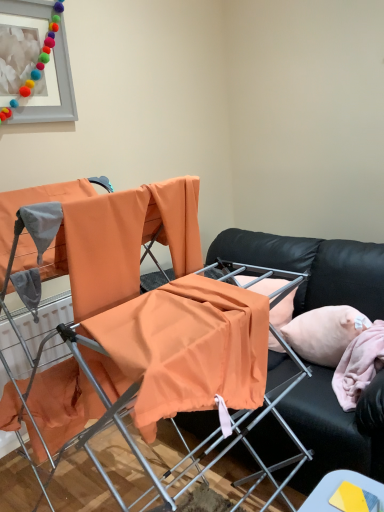
Question: From a real-world perspective, is smooth yellow card at lower right physically below matte gray picture frame at upper left?

Choices:
 (A) yes
 (B) no

Answer: (A)

Question: Considering the relative sizes of smooth yellow card at lower right and matte gray picture frame at upper left in the image provided, is smooth yellow card at lower right smaller than matte gray picture frame at upper left?

Choices:
 (A) yes
 (B) no

Answer: (A)

Question: From the image's perspective, does smooth yellow card at lower right appear lower than matte gray picture frame at upper left?

Choices:
 (A) yes
 (B) no

Answer: (A)

Question: Is smooth yellow card at lower right in front of matte gray picture frame at upper left?

Choices:
 (A) yes
 (B) no

Answer: (A)

Question: Can you confirm if smooth yellow card at lower right is thinner than matte gray picture frame at upper left?

Choices:
 (A) no
 (B) yes

Answer: (A)

Question: Does point (352, 259) appear closer or farther from the camera than point (157, 223)?

Choices:
 (A) closer
 (B) farther

Answer: (B)

Question: In terms of size, does black leather couch at center appear bigger or smaller than orange fabric chair at center?

Choices:
 (A) small
 (B) big

Answer: (A)

Question: Is black leather couch at center spatially inside orange fabric chair at center, or outside of it?

Choices:
 (A) outside
 (B) inside

Answer: (A)

Question: Is black leather couch at center taller or shorter than orange fabric chair at center?

Choices:
 (A) tall
 (B) short

Answer: (B)

Question: From a real-world perspective, is pink fabric pillow at right physically located above or below matte gray picture frame at upper left?

Choices:
 (A) below
 (B) above

Answer: (A)

Question: Considering the positions of point (311, 348) and point (28, 10), is point (311, 348) closer or farther from the camera than point (28, 10)?

Choices:
 (A) farther
 (B) closer

Answer: (B)

Question: Considering the relative positions of pink fabric pillow at right and matte gray picture frame at upper left in the image provided, is pink fabric pillow at right to the left or to the right of matte gray picture frame at upper left?

Choices:
 (A) right
 (B) left

Answer: (A)

Question: Is pink fabric pillow at right wider or thinner than matte gray picture frame at upper left?

Choices:
 (A) thin
 (B) wide

Answer: (B)

Question: Considering the positions of point (244, 370) and point (296, 258), is point (244, 370) closer or farther from the camera than point (296, 258)?

Choices:
 (A) closer
 (B) farther

Answer: (A)

Question: Is orange fabric chair at center to the left or to the right of black leather couch at center in the image?

Choices:
 (A) left
 (B) right

Answer: (A)